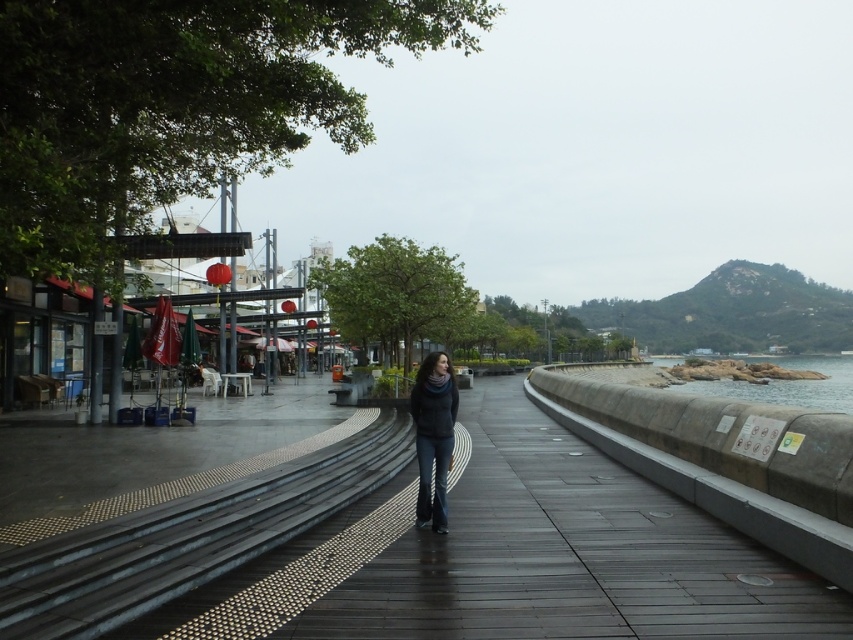
Question: Does smooth concrete steps at lower left have a smaller size compared to rocky shore at right?

Choices:
 (A) no
 (B) yes

Answer: (B)

Question: Can you confirm if wooden at center is bigger than dark gray sweater at center?

Choices:
 (A) yes
 (B) no

Answer: (B)

Question: Considering the real-world distances, which object is closest to the wooden at center?

Choices:
 (A) rocky shore at right
 (B) smooth concrete steps at lower left
 (C) dark gray sweater at center

Answer: (B)

Question: Which point is farther from the camera taking this photo?

Choices:
 (A) (212, 554)
 (B) (509, 556)
 (C) (448, 401)
 (D) (701, 388)

Answer: (D)

Question: Observing the image, what is the correct spatial positioning of wooden at center in reference to rocky shore at right?

Choices:
 (A) below
 (B) above

Answer: (B)

Question: Among these objects, which one is farthest from the camera?

Choices:
 (A) rocky shore at right
 (B) wooden at center

Answer: (A)